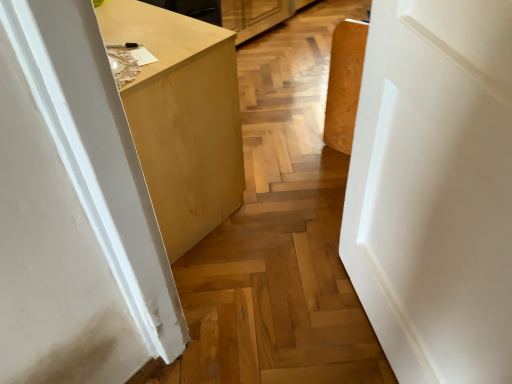
Question: Considering their positions, is matte wood cabinet at center located in front of or behind white matte door at center?

Choices:
 (A) front
 (B) behind

Answer: (B)

Question: From a real-world perspective, is matte wood cabinet at center positioned above or below white matte door at center?

Choices:
 (A) below
 (B) above

Answer: (A)

Question: Considering the positions of matte wood cabinet at center and white matte door at center in the image, is matte wood cabinet at center wider or thinner than white matte door at center?

Choices:
 (A) wide
 (B) thin

Answer: (A)

Question: In the image, is white matte door at center positioned in front of or behind matte wood cabinet at center?

Choices:
 (A) front
 (B) behind

Answer: (A)

Question: In terms of height, does white matte door at center look taller or shorter compared to matte wood cabinet at center?

Choices:
 (A) short
 (B) tall

Answer: (B)

Question: Which is correct: white matte door at center is inside matte wood cabinet at center, or outside of it?

Choices:
 (A) inside
 (B) outside

Answer: (B)

Question: In terms of width, does white matte door at center look wider or thinner when compared to matte wood cabinet at center?

Choices:
 (A) wide
 (B) thin

Answer: (B)